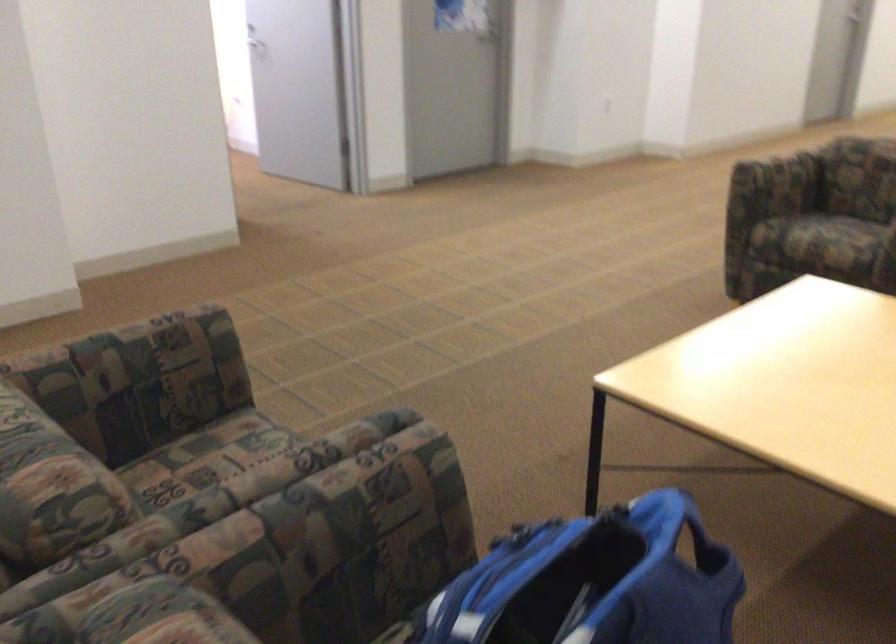
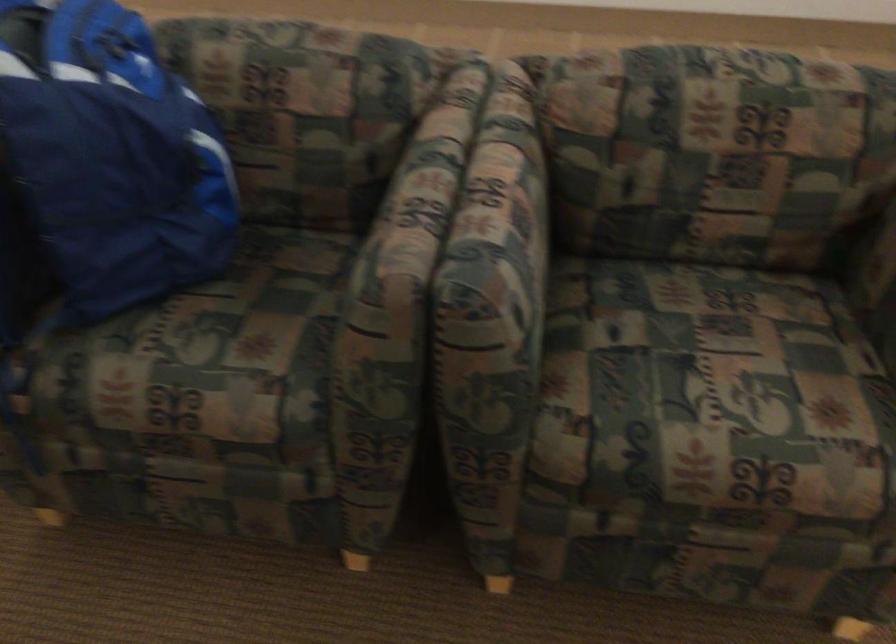
The point at (290, 451) is marked in the first image. Where is the corresponding point in the second image?

(510, 196)